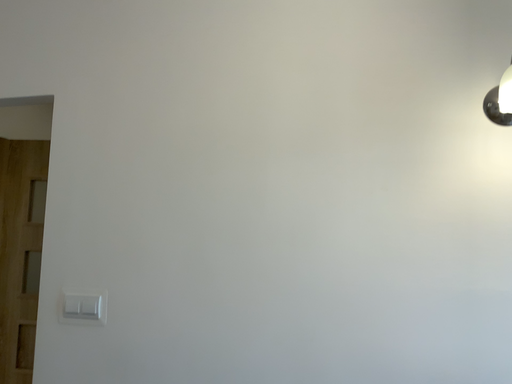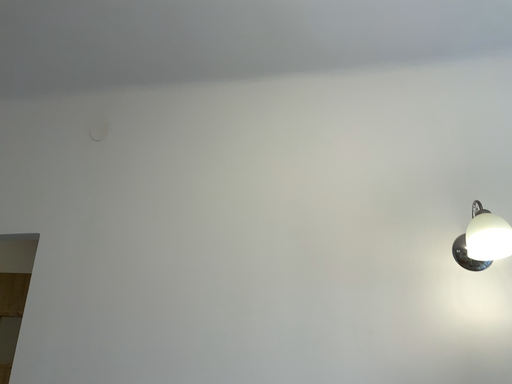
Question: How did the camera likely rotate when shooting the video?

Choices:
 (A) rotated downward
 (B) rotated upward

Answer: (B)